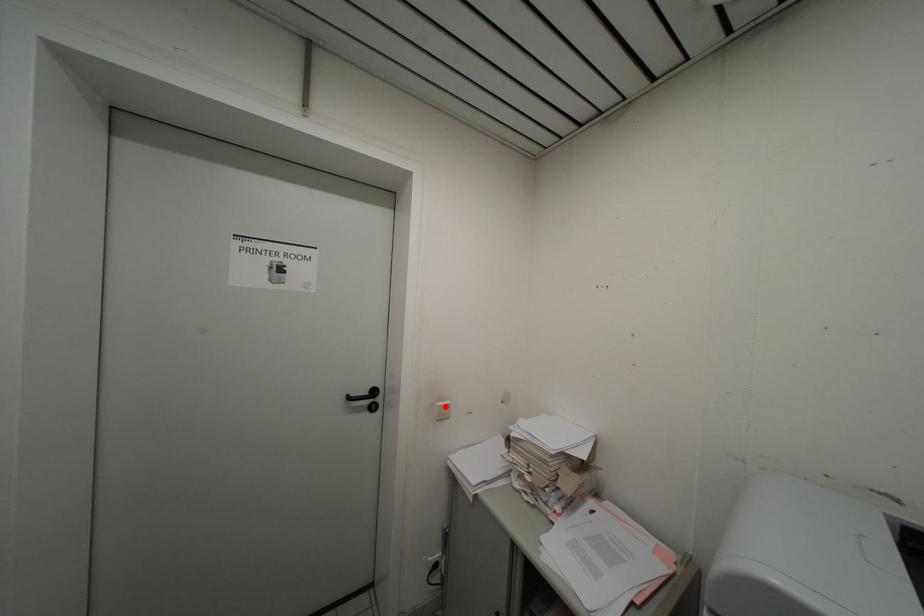
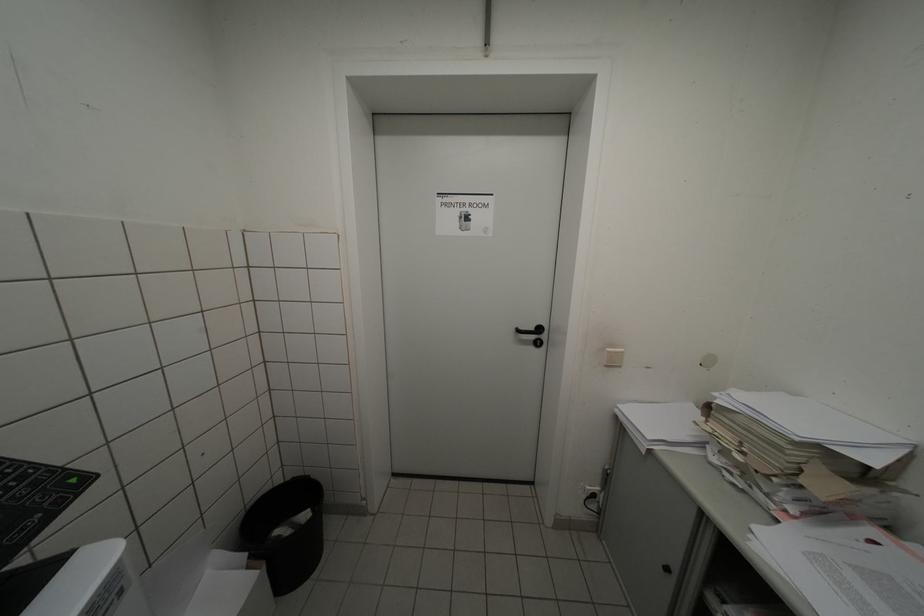
Find the pixel in the second image that matches the highlighted location in the first image.

(615, 352)